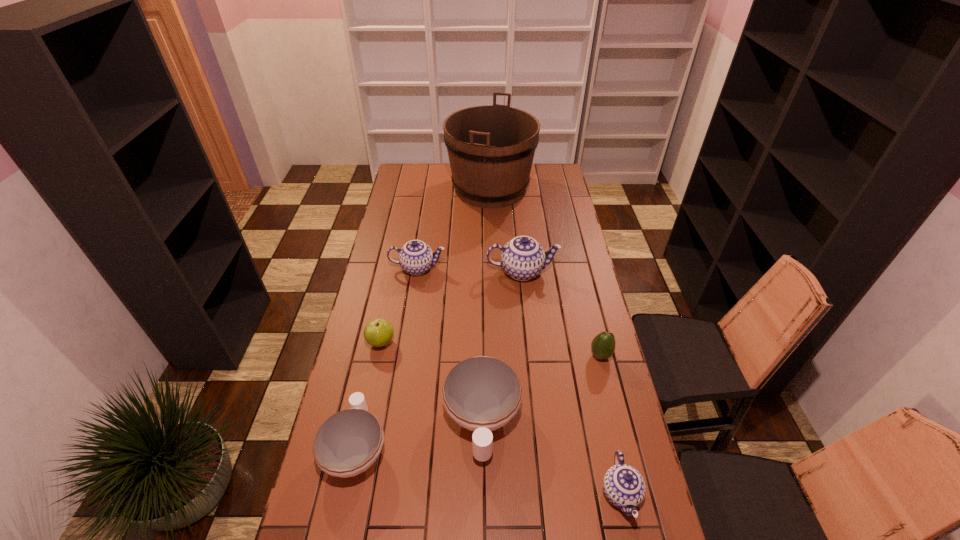
Where is `white chinaware that can be found as the closest to the avocado`? The height and width of the screenshot is (540, 960). white chinaware that can be found as the closest to the avocado is located at coordinates (482, 394).

I want to click on white chinaware that is the nearest to the avocado, so click(x=482, y=394).

Identify the location of free location that satisfies the following two spatial constraints: 1. on the front side of the farthest object; 2. on the right side of the green avocado. This screenshot has width=960, height=540. (496, 355).

Find the location of a particular element. vacant space that satisfies the following two spatial constraints: 1. at the spout of the second blue chinaware from left to right; 2. on the back side of the avocado is located at coordinates (531, 355).

Locate an element on the screen. The width and height of the screenshot is (960, 540). free spot that satisfies the following two spatial constraints: 1. on the back side of the avocado; 2. at the spout of the second biggest blue chinaware is located at coordinates (579, 268).